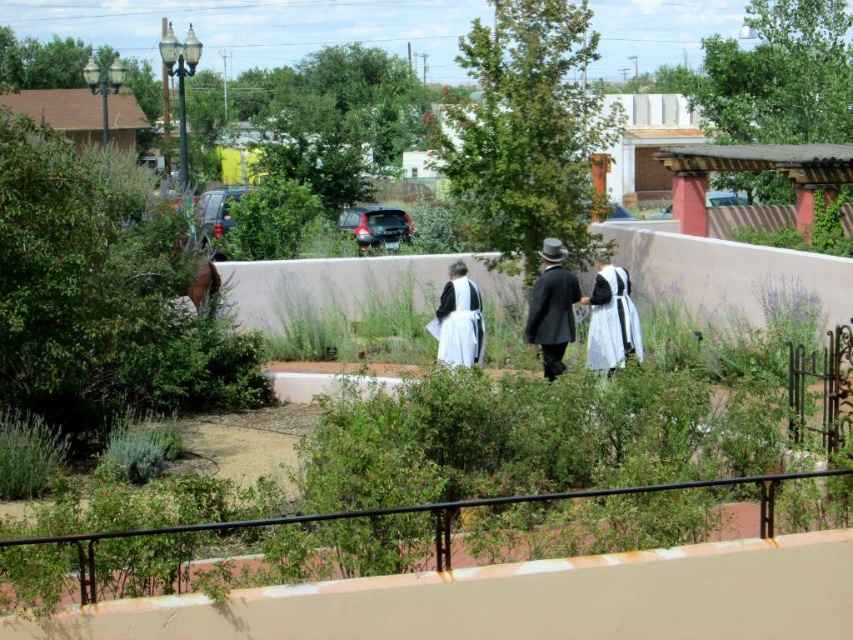
Where is the matte black coat at center located in the image?

The matte black coat at center is located at point 0.483 in the x coordinate and 0.648 in the y coordinate.